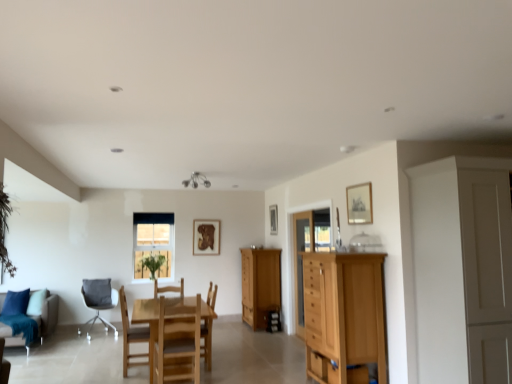
Question: Considering the relative positions of wooden chair at center, the first chair when ordered from right to left, and wooden picture frame at upper right, the first picture frame positioned from the front, in the image provided, is wooden chair at center, the first chair when ordered from right to left, to the left of wooden picture frame at upper right, the first picture frame positioned from the front, from the viewer's perspective?

Choices:
 (A) no
 (B) yes

Answer: (B)

Question: Does wooden chair at center, acting as the third chair starting from the front, have a lesser width compared to wooden picture frame at upper right, the first picture frame positioned from the front?

Choices:
 (A) no
 (B) yes

Answer: (A)

Question: Is wooden picture frame at upper right, marked as the first picture frame in a right-to-left arrangement, surrounded by wooden chair at center, marked as the second chair in a back-to-front arrangement?

Choices:
 (A) no
 (B) yes

Answer: (A)

Question: From a real-world perspective, is wooden chair at center, marked as the second chair in a back-to-front arrangement, physically below wooden picture frame at upper right, arranged as the third picture frame when viewed from the left?

Choices:
 (A) yes
 (B) no

Answer: (A)

Question: From the image's perspective, is wooden chair at center, the fourth chair in the left-to-right sequence, located beneath wooden picture frame at upper right, the first picture frame positioned from the front?

Choices:
 (A) yes
 (B) no

Answer: (A)

Question: Can you confirm if wooden chair at center, the fourth chair in the left-to-right sequence, is smaller than wooden picture frame at upper right, the first picture frame positioned from the front?

Choices:
 (A) no
 (B) yes

Answer: (A)

Question: Does green leafy plant at center have a lesser width compared to wooden picture frame at upper right, the 3th picture frame in the back-to-front sequence?

Choices:
 (A) yes
 (B) no

Answer: (B)

Question: From the image's perspective, does green leafy plant at center appear lower than wooden picture frame at upper right, the 3th picture frame in the back-to-front sequence?

Choices:
 (A) no
 (B) yes

Answer: (B)

Question: Does green leafy plant at center have a smaller size compared to wooden picture frame at upper right, arranged as the third picture frame when viewed from the left?

Choices:
 (A) yes
 (B) no

Answer: (B)

Question: Is green leafy plant at center positioned behind wooden picture frame at upper right, the 3th picture frame in the back-to-front sequence?

Choices:
 (A) no
 (B) yes

Answer: (B)

Question: Considering the relative positions of green leafy plant at center and wooden picture frame at upper right, arranged as the third picture frame when viewed from the left, in the image provided, is green leafy plant at center to the right of wooden picture frame at upper right, arranged as the third picture frame when viewed from the left, from the viewer's perspective?

Choices:
 (A) yes
 (B) no

Answer: (B)

Question: Is green leafy plant at center next to wooden picture frame at upper right, arranged as the third picture frame when viewed from the left?

Choices:
 (A) no
 (B) yes

Answer: (A)

Question: From the image's perspective, is wooden frame at center located beneath wooden cabinet at center?

Choices:
 (A) no
 (B) yes

Answer: (A)